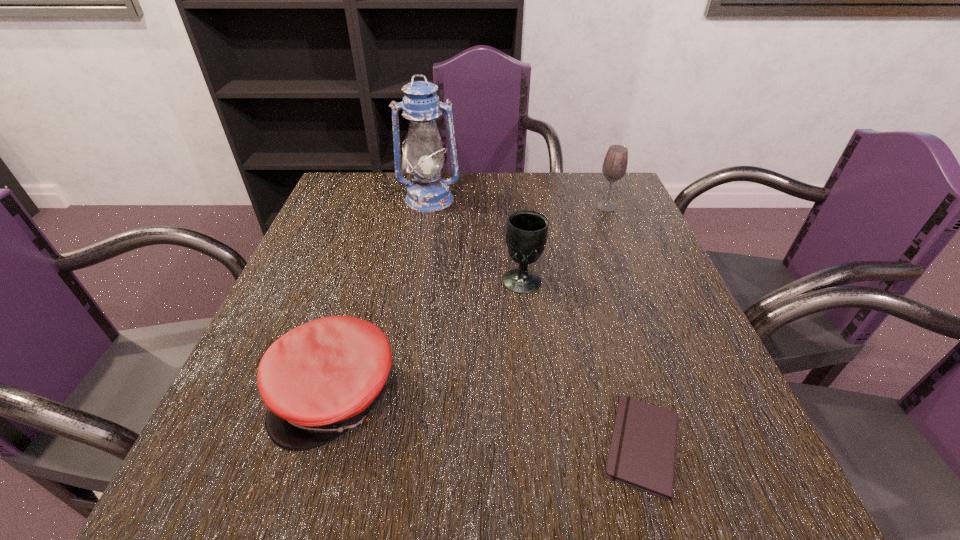
Find the location of a particular element. free space at the left edge is located at coordinates (241, 414).

In the image, there is a desktop. Find the location of `vacant space at the right edge`. vacant space at the right edge is located at coordinates (642, 296).

Image resolution: width=960 pixels, height=540 pixels. I want to click on vacant region at the far left corner of the desktop, so click(x=375, y=193).

In the image, there is a desktop. Identify the location of vacant area at the far right corner. (577, 197).

Identify the location of free space at the near right corner of the desktop. (708, 476).

The image size is (960, 540). In order to click on free spot between the lantern and the second shortest object in this screenshot , I will do tap(383, 297).

At what (x,y) coordinates should I click in order to perform the action: click on free spot between the checkbook and the glass drink container. Please return your answer as a coordinate pair (x, y). The width and height of the screenshot is (960, 540). Looking at the image, I should click on (625, 327).

You are a GUI agent. You are given a task and a screenshot of the screen. Output one action in this format:
    pyautogui.click(x=<x>, y=<y>)
    Task: Click on the vacant region between the glass drink container and the tallest object
    
    Given the screenshot: What is the action you would take?
    pyautogui.click(x=517, y=203)

Identify the location of empty location between the glass drink container and the second shortest object. (471, 301).

At what (x,y) coordinates should I click in order to perform the action: click on vacant point located between the fourth tallest object and the shortest object. Please return your answer as a coordinate pair (x, y). Looking at the image, I should click on 490,421.